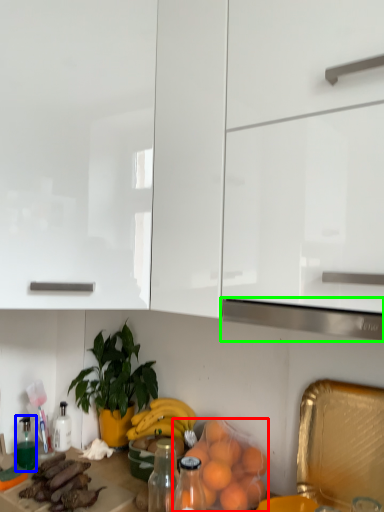
Question: Estimate the real-world distances between objects in this image. Which object is closer to orange (highlighted by a red box), bottle (highlighted by a blue box) or exhaust hood (highlighted by a green box)?

Choices:
 (A) bottle
 (B) exhaust hood

Answer: (B)